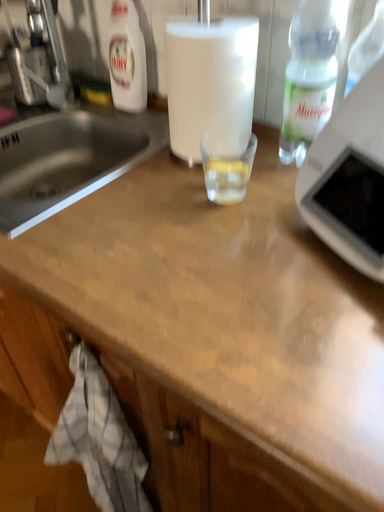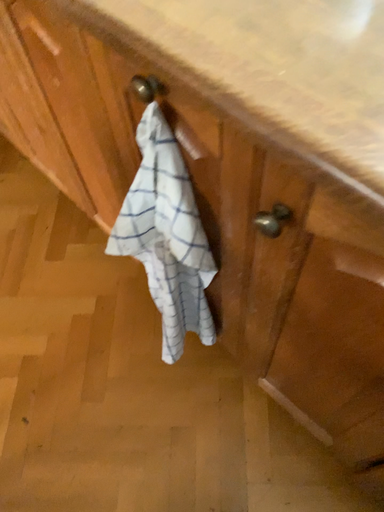
Question: How did the camera likely rotate when shooting the video?

Choices:
 (A) rotated upward
 (B) rotated downward

Answer: (B)